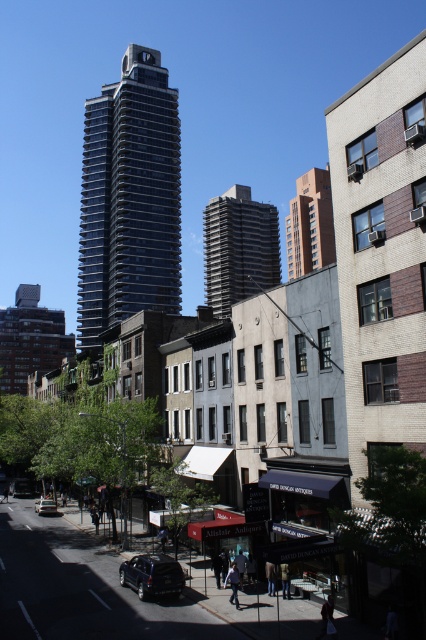
Between shiny glass building at center and metallic silver car at lower left, which one has less height?

metallic silver car at lower left is shorter.

Does shiny glass building at center appear on the right side of metallic silver car at lower left?

No, shiny glass building at center is not to the right of metallic silver car at lower left.

Who is more distant from viewer, [137,237] or [48,502]?

Point [137,237]

I want to click on shiny glass building at center, so click(x=129, y=198).

Can you confirm if dark gray concrete building at center is bigger than burgundy brick building at upper center?

Yes.

Is dark gray concrete building at center further to camera compared to burgundy brick building at upper center?

That is False.

Is point (265, 275) positioned behind point (322, 260)?

No, it is not.

Where is `dark gray concrete building at center`? The width and height of the screenshot is (426, 640). dark gray concrete building at center is located at coordinates (238, 248).

Between shiny black suv at lower left and metallic silver car at lower left, which one appears on the left side from the viewer's perspective?

Positioned to the left is metallic silver car at lower left.

Is shiny black suv at lower left taller than metallic silver car at lower left?

Incorrect, shiny black suv at lower left's height is not larger of metallic silver car at lower left's.

Which is behind, point (169, 577) or point (43, 508)?

The point (43, 508) is behind.

Locate an element on the screen. This screenshot has height=640, width=426. shiny black suv at lower left is located at coordinates (152, 576).